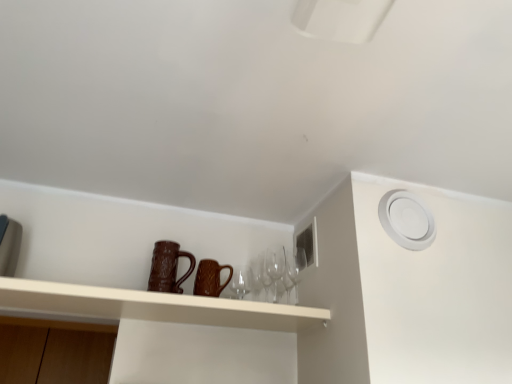
Question: Is matte brown mugs at center in front of or behind brown textured mug at center, the second mug from the left, in the image?

Choices:
 (A) front
 (B) behind

Answer: (A)

Question: Visually, is matte brown mugs at center positioned to the left or to the right of brown textured mug at center, the second mug from the left?

Choices:
 (A) left
 (B) right

Answer: (A)

Question: Which of these objects is positioned farthest from the brown textured mug at center, marked as the 2th mug in a right-to-left arrangement?

Choices:
 (A) brown textured mug at center, the second mug from the left
 (B) transparent glass wine glasses at center, the 2th wine glass positioned from the right
 (C) matte brown mugs at center
 (D) transparent glass wine glass at center, marked as the first wine glass in a right-to-left arrangement

Answer: (D)

Question: Estimate the real-world distances between objects in this image. Which object is farther from the brown textured mug at center, acting as the 1th mug starting from the right?

Choices:
 (A) matte brown mugs at center
 (B) transparent glass wine glass at center, marked as the first wine glass in a right-to-left arrangement
 (C) transparent glass wine glasses at center, which is counted as the first wine glass, starting from the left
 (D) brown textured mug at center, marked as the 2th mug in a right-to-left arrangement

Answer: (B)